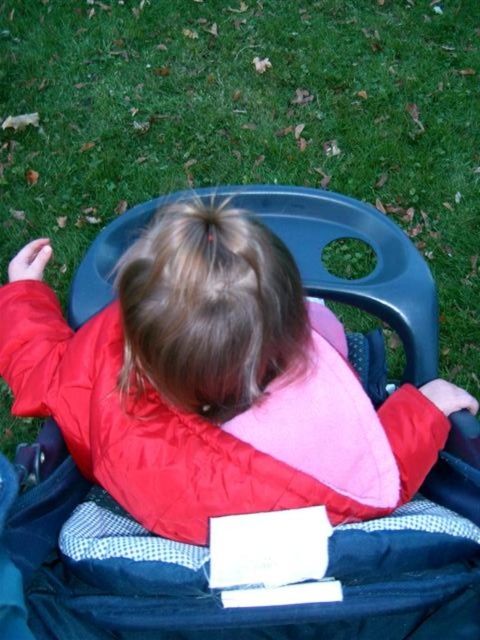
You are a photographer trying to capture the stroller and the grass in the image. Since you want both the matte black stroller at center and the green grass at center to be visible in your photo, which object should you focus on first to ensure proper exposure?

The green grass at center is positioned on the right side of matte black stroller at center. Since the grass is lighter in color, focusing on it first would help balance the exposure, ensuring both the stroller and the grass are properly lit in the photo.

You are a parent trying to clean the stroller. You notice the green grass at center and the matte black stroller at center. Which object is located above the other?

The green grass at center is positioned over matte black stroller at center, meaning the grass is above the stroller.